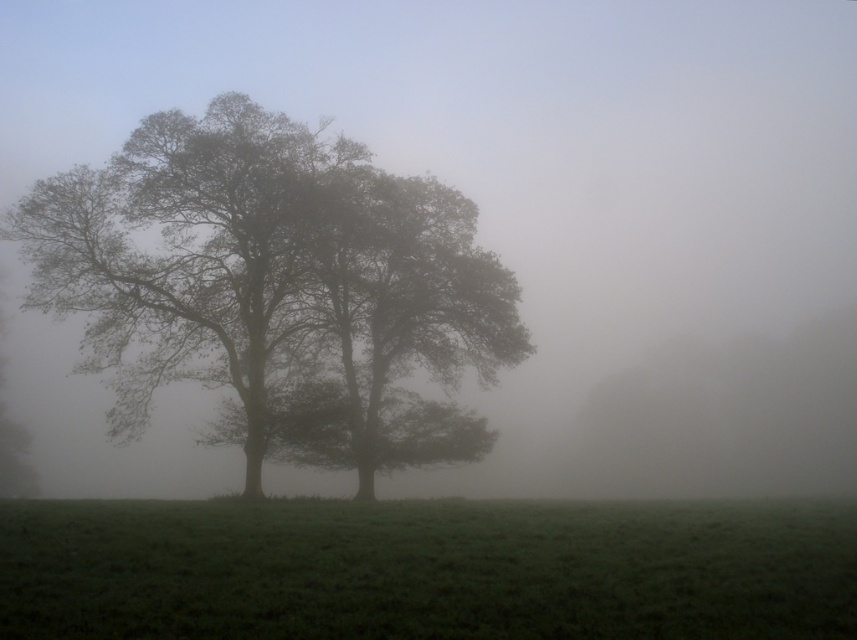
Question: Which point appears closest to the camera in this image?

Choices:
 (A) (610, 506)
 (B) (472, 289)

Answer: (A)

Question: Can you confirm if dark gray textured tree at center is positioned below green grassy field at center?

Choices:
 (A) yes
 (B) no

Answer: (B)

Question: Is dark gray textured tree at center to the right of green grassy field at center from the viewer's perspective?

Choices:
 (A) yes
 (B) no

Answer: (B)

Question: Among these objects, which one is nearest to the camera?

Choices:
 (A) dark gray textured tree at center
 (B) green grassy field at center

Answer: (B)

Question: Can you confirm if dark gray textured tree at center is positioned below green grassy field at center?

Choices:
 (A) no
 (B) yes

Answer: (A)